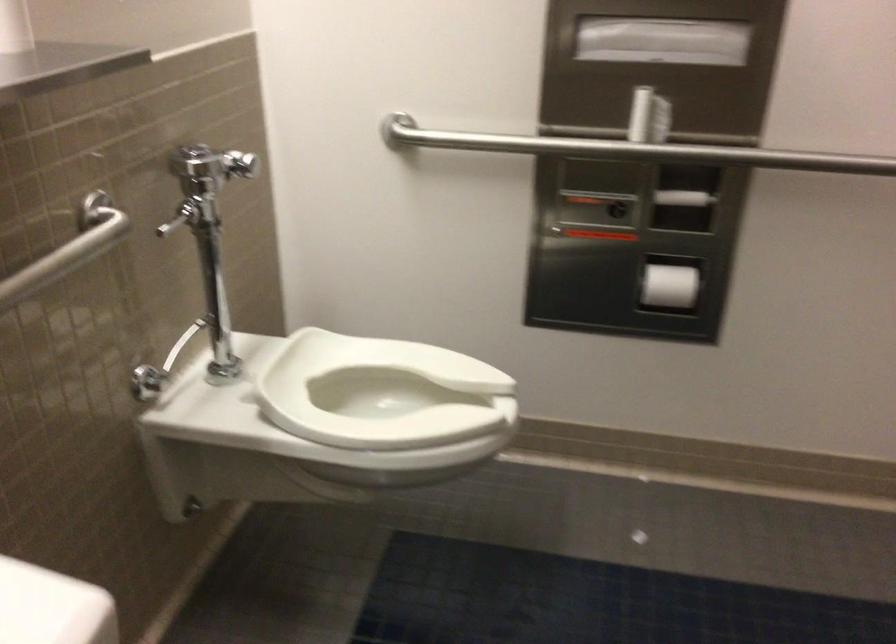
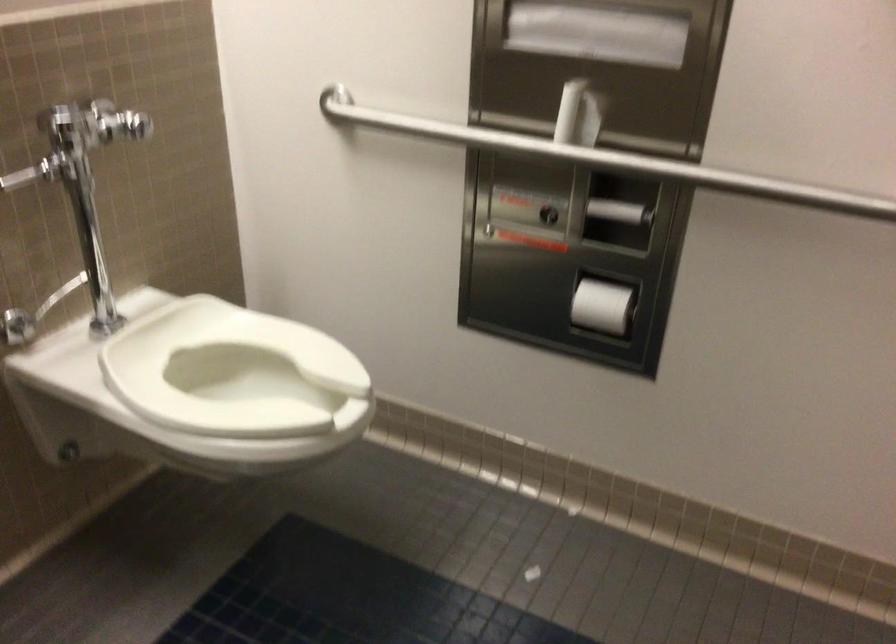
Question: In a continuous first-person perspective shot, in which direction is the camera moving?

Choices:
 (A) Left
 (B) Right
 (C) Forward
 (D) Backward

Answer: (B)